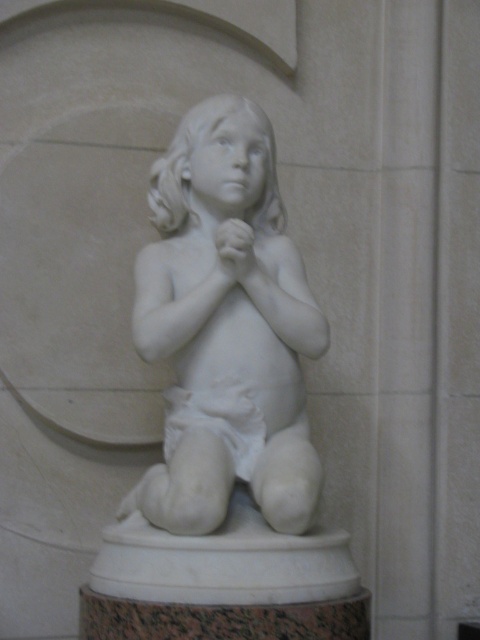
Can you confirm if white marble statue at center is positioned below white matte diaper at center?

Incorrect, white marble statue at center is not positioned below white matte diaper at center.

Between white marble statue at center and white matte diaper at center, which one appears on the right side from the viewer's perspective?

From the viewer's perspective, white marble statue at center appears more on the right side.

Which is behind, point (282, 248) or point (239, 440)?

The point (282, 248) is more distant.

This screenshot has height=640, width=480. What are the coordinates of `white marble statue at center` in the screenshot? It's located at [x=227, y=326].